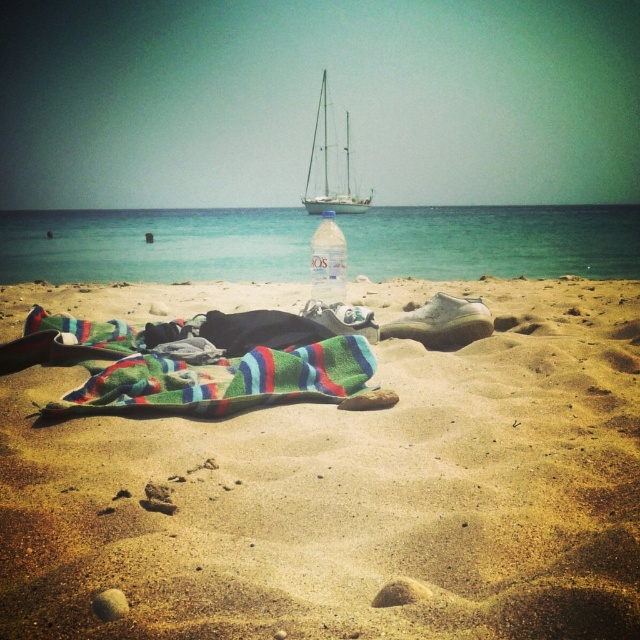
You are planning to set up a small picnic on the beach. You have a striped cotton towel at center and a clear plastic bottle at center. Which item would you use to cover your snacks to protect them from sand?

The striped cotton towel at center is bigger than the clear plastic bottle at center, so you can use the striped cotton towel at center to cover your snacks and protect them from sand.

You are a photographer trying to capture the striped cotton towel at center without the clear blue water at center appearing in the foreground. Is this possible given their positions?

The striped cotton towel at center is behind the clear blue water at center, so you can position the camera so the striped cotton towel at center is visible while the clear blue water at center is out of the frame or obscured by adjusting the angle or moving around the scene.

You are a beachgoer who wants to place your clear plastic bottle at center on a flat surface to prevent it from tipping over. The striped cotton towel at center is already on the sand. Which surface would provide a more stable base for the bottle?

The striped cotton towel at center provides a more stable base for the clear plastic bottle at center because it is below the bottle, offering a flat surface to prevent tipping.